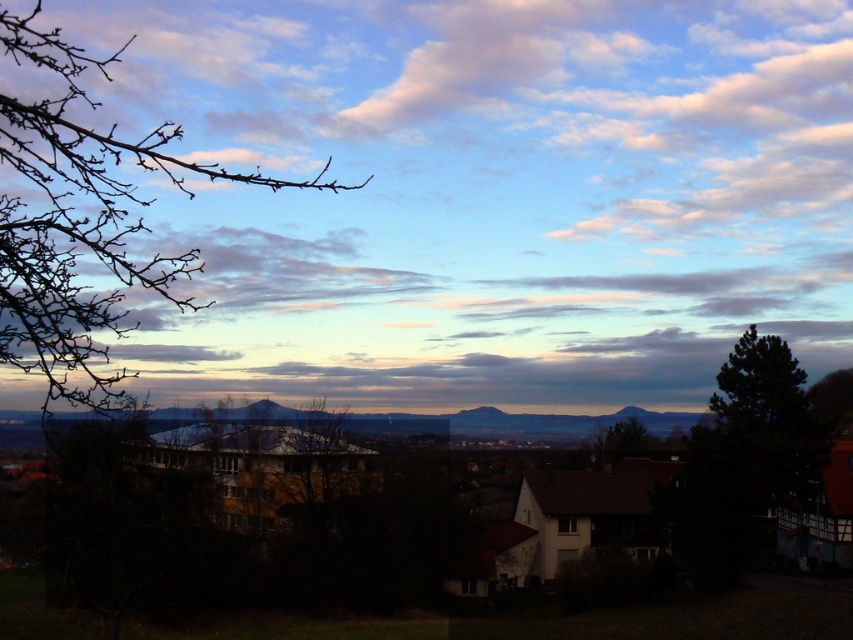
Is brown bare branches at left positioned at the back of green leafy tree at center?

No, it is not.

Is brown bare branches at left closer to camera compared to green leafy tree at center?

That is True.

Between point (103, 257) and point (628, 449), which one is positioned behind?

Positioned behind is point (628, 449).

This screenshot has height=640, width=853. Identify the location of brown bare branches at left. (80, 221).

Between cloudy sky at upper center and brown bare branches at left, which one appears on the left side from the viewer's perspective?

brown bare branches at left

Does cloudy sky at upper center have a lesser width compared to brown bare branches at left?

In fact, cloudy sky at upper center might be wider than brown bare branches at left.

In order to click on cloudy sky at upper center in this screenshot , I will do `click(489, 195)`.

Between cloudy sky at upper center and green leafy tree at center, which one has more height?

cloudy sky at upper center

Based on the photo, which is more to the right, cloudy sky at upper center or green leafy tree at center?

green leafy tree at center

Does point (85, 10) come farther from viewer compared to point (625, 433)?

Yes, it is behind point (625, 433).

You are a GUI agent. You are given a task and a screenshot of the screen. Output one action in this format:
    pyautogui.click(x=<x>, y=<y>)
    Task: Click on the cloudy sky at upper center
    This screenshot has height=640, width=853.
    Given the screenshot: What is the action you would take?
    tap(489, 195)